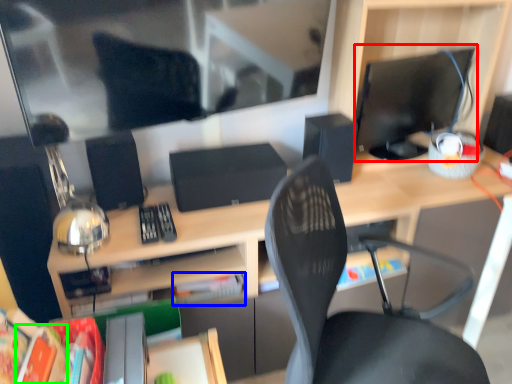
Question: Which object is positioned farthest from computer monitor (highlighted by a red box)? Select from paperback book (highlighted by a blue box) and paperback book (highlighted by a green box).

Choices:
 (A) paperback book
 (B) paperback book

Answer: (B)